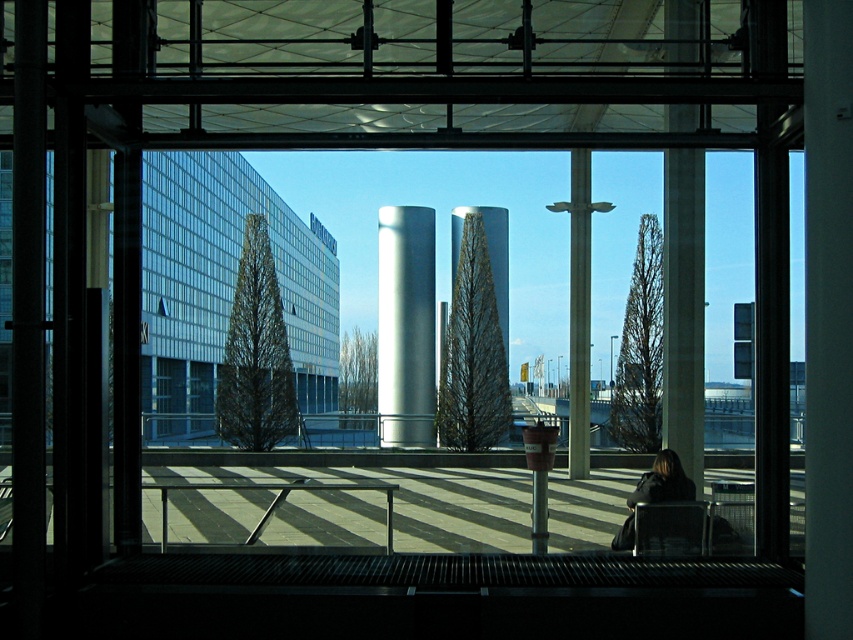
Can you confirm if satin silver cylinder at center is positioned below dark brown leather jacket at lower right?

No, satin silver cylinder at center is not below dark brown leather jacket at lower right.

Identify the location of satin silver cylinder at center. (405, 324).

Does point (672, 477) come behind point (703, 516)?

Yes, it is.

Between point (683, 515) and point (636, 554), which one is positioned behind?

Point (683, 515)

Between point (654, 534) and point (660, 545), which one is positioned in front?

Point (660, 545) is in front.

Locate an element on the screen. This screenshot has width=853, height=640. dark brown leather jacket at lower right is located at coordinates (662, 483).

Is satin silver cylinder at center below matte black chair at lower right?

Actually, satin silver cylinder at center is above matte black chair at lower right.

Find the location of a particular element. This screenshot has width=853, height=640. satin silver cylinder at center is located at coordinates (405, 324).